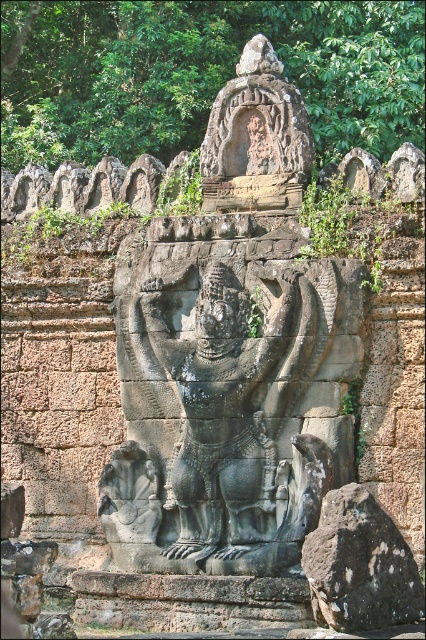
Question: Which point appears farthest from the camera in this image?

Choices:
 (A) (175, 518)
 (B) (397, 560)

Answer: (A)

Question: Is black stone deity at center positioned behind black rough rock at lower right?

Choices:
 (A) yes
 (B) no

Answer: (A)

Question: Is black stone deity at center above black rough rock at lower right?

Choices:
 (A) yes
 (B) no

Answer: (A)

Question: Is the position of black stone deity at center less distant than that of black rough rock at lower right?

Choices:
 (A) no
 (B) yes

Answer: (A)